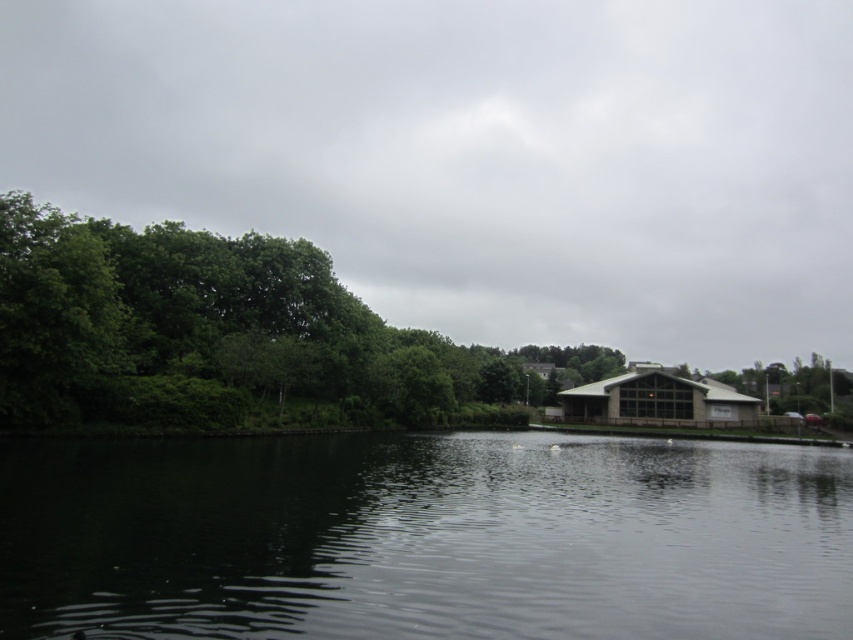
Who is more forward, (630, 561) or (178, 321)?

Positioned in front is point (630, 561).

Which of these two, dark reflective water at center or green leafy trees at left, stands shorter?

dark reflective water at center

Locate an element on the screen. dark reflective water at center is located at coordinates [424, 538].

Where is `dark reflective water at center`? dark reflective water at center is located at coordinates (424, 538).